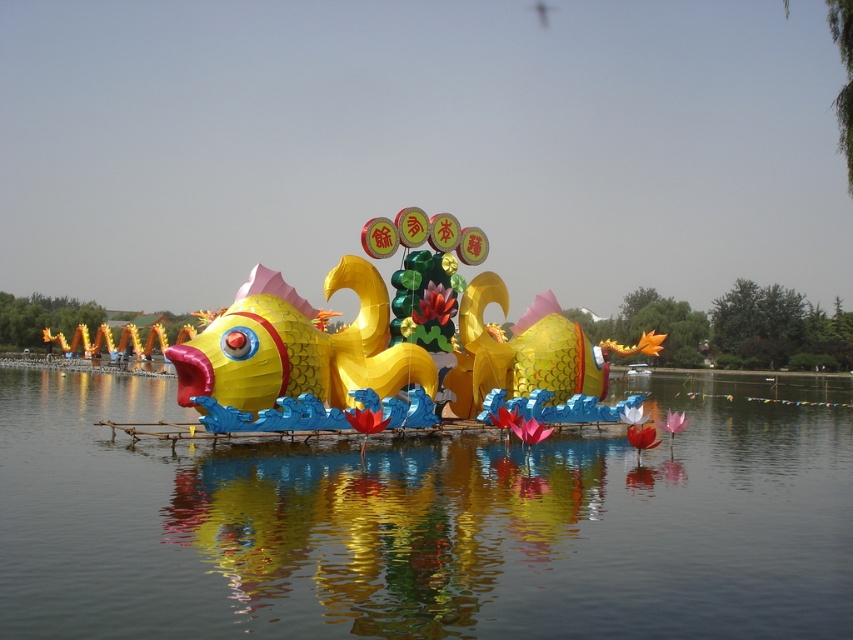
Who is higher up, glossy water at center or shiny gold fish at center?

shiny gold fish at center is higher up.

Can you confirm if glossy water at center is positioned above shiny gold fish at center?

Incorrect, glossy water at center is not positioned above shiny gold fish at center.

Which is in front, point (62, 504) or point (376, 364)?

Point (62, 504)

Identify the location of glossy water at center. The height and width of the screenshot is (640, 853). point(421,525).